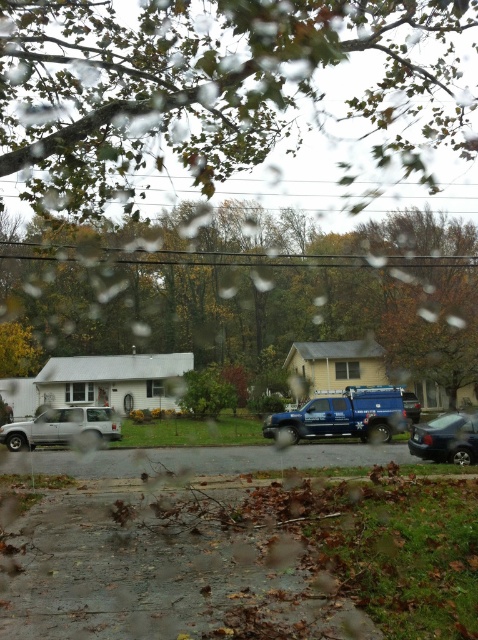
Is silver metallic suv at left above shiny black sedan at lower right?

Incorrect, silver metallic suv at left is not positioned above shiny black sedan at lower right.

Does silver metallic suv at left have a lesser width compared to shiny black sedan at lower right?

No, silver metallic suv at left is not thinner than shiny black sedan at lower right.

In order to click on silver metallic suv at left in this screenshot , I will do `click(64, 428)`.

Find the location of a particular element. The image size is (478, 640). silver metallic suv at left is located at coordinates (64, 428).

Locate an element on the screen. The image size is (478, 640). blue metallic truck at center is located at coordinates (347, 416).

Does point (391, 410) come closer to viewer compared to point (98, 417)?

Yes.

Identify the location of blue metallic truck at center. This screenshot has height=640, width=478. (347, 416).

Does green leafy tree at center have a larger size compared to silver metallic suv at left?

Yes.

Who is more distant from viewer, (132, 257) or (101, 412)?

Positioned behind is point (132, 257).

Where is `green leafy tree at center`? This screenshot has width=478, height=640. green leafy tree at center is located at coordinates (274, 292).